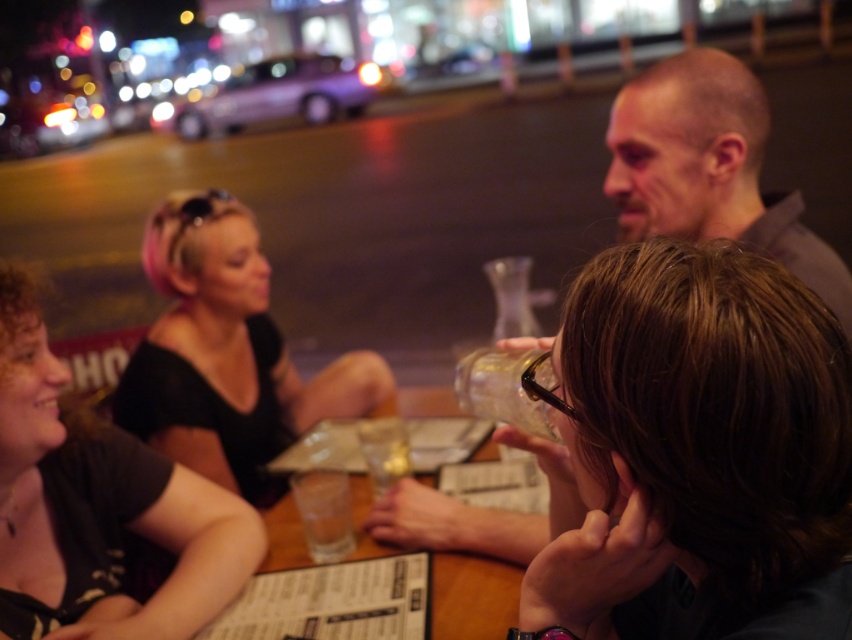
You are a waiter at the outdoor cafe. You need to pour a drink from the transparent glass bottle at center into the transparent glass at center. Which container will be filled first?

The transparent glass at center will be filled first because the transparent glass bottle at center has a lesser height, meaning it contains less liquid to pour into the transparent glass at center.

What are the coordinates of the brown hair at center?

The brown hair at center is located at coordinates point (x=695, y=452).